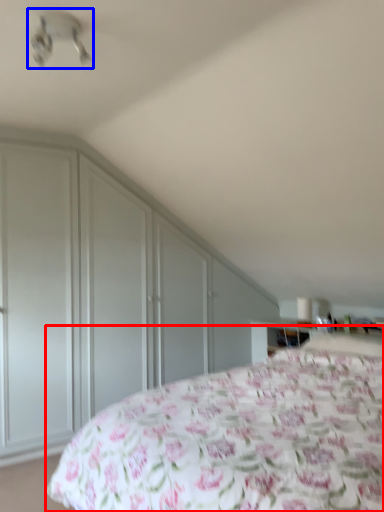
Question: Which object appears farthest to the camera in this image, bed (highlighted by a red box) or fan (highlighted by a blue box)?

Choices:
 (A) bed
 (B) fan

Answer: (B)